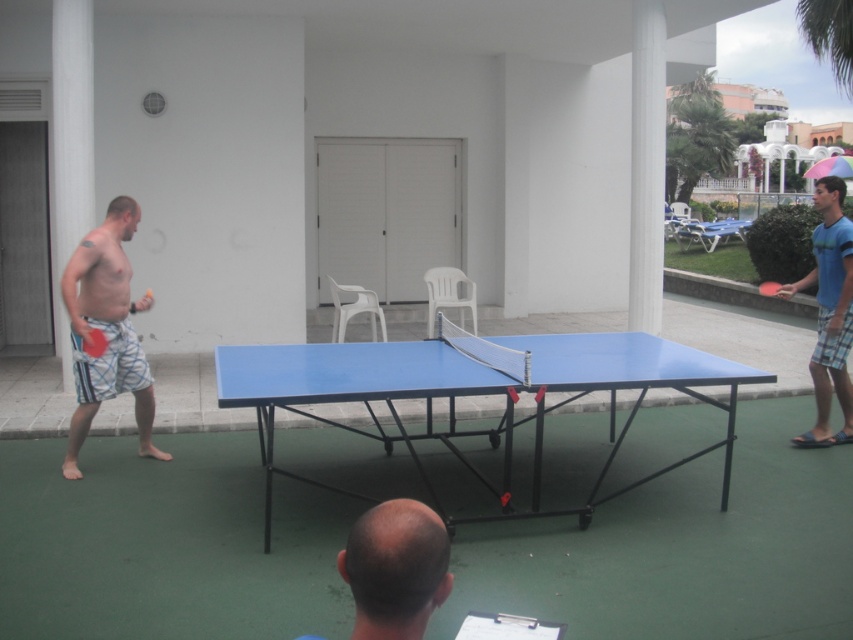
Between matte blue shorts at left and blue plastic table tennis table at center, which one has less height?

blue plastic table tennis table at center is shorter.

Which is in front, point (85, 388) or point (775, 291)?

Point (85, 388) is more forward.

Describe the element at coordinates (106, 330) in the screenshot. I see `matte blue shorts at left` at that location.

What are the coordinates of `matte blue shorts at left` in the screenshot? It's located at (106, 330).

Which is behind, point (525, 419) or point (109, 282)?

The point (525, 419) is behind.

Who is more forward, (265, 440) or (64, 474)?

Point (64, 474)

Is point (405, 358) farther from camera compared to point (132, 358)?

No, it is in front of (132, 358).

At what (x,y) coordinates should I click in order to perform the action: click on blue plastic table at center. Please return your answer as a coordinate pair (x, y). Image resolution: width=853 pixels, height=640 pixels. Looking at the image, I should click on (473, 394).

Does blue plaid shorts at right have a greater width compared to blue matte table tennis table at center?

Yes, blue plaid shorts at right is wider than blue matte table tennis table at center.

Does point (831, 435) come closer to viewer compared to point (93, 332)?

No, it is behind (93, 332).

Which is in front, point (815, 196) or point (103, 340)?

Positioned in front is point (103, 340).

The height and width of the screenshot is (640, 853). I want to click on blue plaid shorts at right, so click(x=828, y=312).